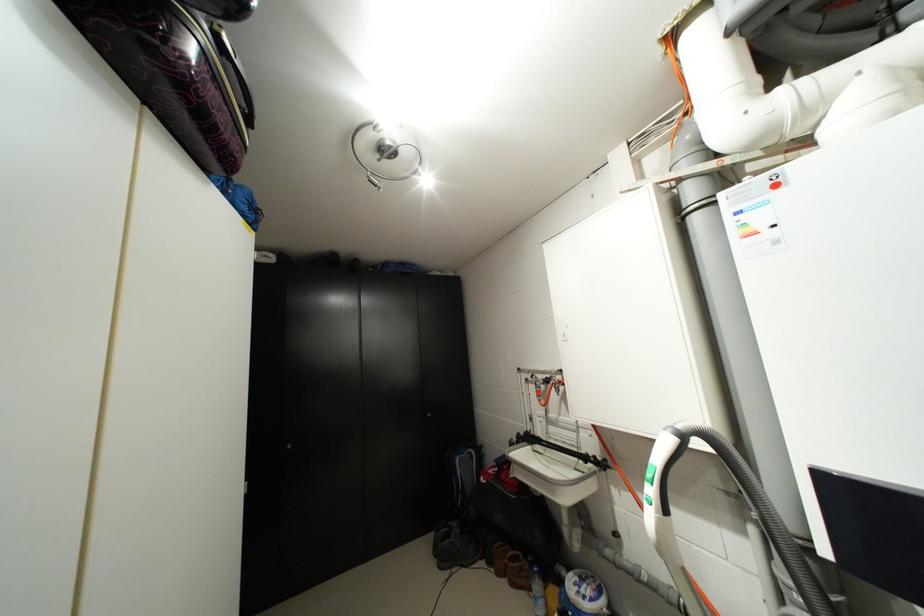
Image resolution: width=924 pixels, height=616 pixels. Identify the location of blue backpack. (238, 198).